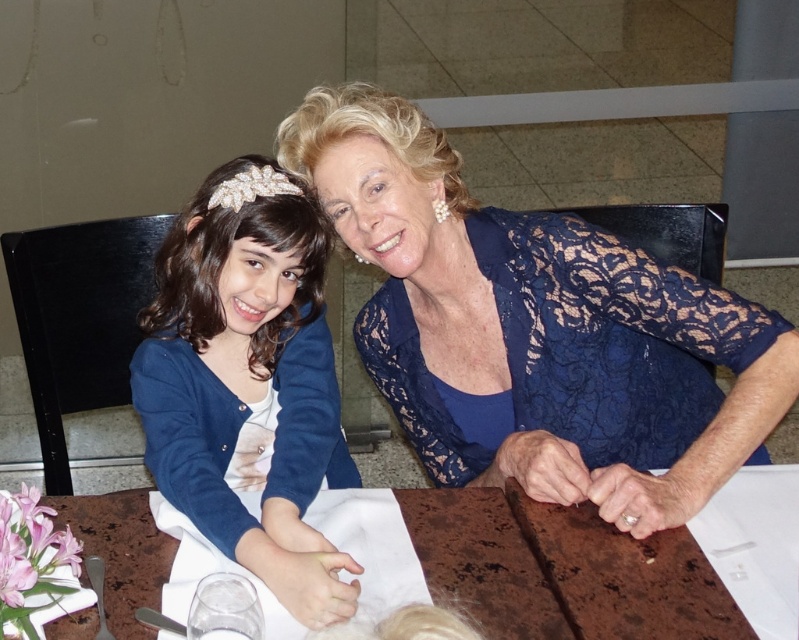
Is lace fabric at center to the left of brown marble table at center from the viewer's perspective?

Correct, you'll find lace fabric at center to the left of brown marble table at center.

The height and width of the screenshot is (640, 799). What do you see at coordinates (535, 326) in the screenshot?
I see `lace fabric at center` at bounding box center [535, 326].

Where is `lace fabric at center`? Image resolution: width=799 pixels, height=640 pixels. lace fabric at center is located at coordinates (535, 326).

Is matte blue sweater at left in front of brown marble table at center?

That is False.

Is point (240, 392) farther from camera compared to point (149, 589)?

Yes, point (240, 392) is farther from viewer.

Is point (149, 397) closer to camera compared to point (611, 604)?

No.

Find the location of a particular element. The height and width of the screenshot is (640, 799). matte blue sweater at left is located at coordinates (247, 380).

Is the position of lace fabric at center less distant than that of matte blue sweater at left?

No, lace fabric at center is further to the viewer.

Between lace fabric at center and matte blue sweater at left, which one is positioned higher?

lace fabric at center is higher up.

Describe the element at coordinates (535, 326) in the screenshot. Image resolution: width=799 pixels, height=640 pixels. I see `lace fabric at center` at that location.

At what (x,y) coordinates should I click in order to perform the action: click on lace fabric at center. Please return your answer as a coordinate pair (x, y). This screenshot has width=799, height=640. Looking at the image, I should click on (535, 326).